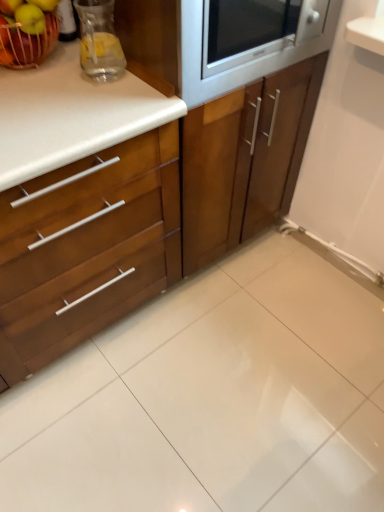
Question: Should I look upward or downward to see clear glass pitcher at upper left?

Choices:
 (A) down
 (B) up

Answer: (B)

Question: Does satin silver microwave at upper center have a lesser height compared to white glossy ceramic tile at center?

Choices:
 (A) yes
 (B) no

Answer: (B)

Question: Considering the relative sizes of satin silver microwave at upper center and white glossy ceramic tile at center in the image provided, is satin silver microwave at upper center taller than white glossy ceramic tile at center?

Choices:
 (A) no
 (B) yes

Answer: (B)

Question: Is satin silver microwave at upper center next to white glossy ceramic tile at center?

Choices:
 (A) yes
 (B) no

Answer: (B)

Question: Is satin silver microwave at upper center outside of white glossy ceramic tile at center?

Choices:
 (A) no
 (B) yes

Answer: (B)

Question: Considering the relative sizes of satin silver microwave at upper center and white glossy ceramic tile at center in the image provided, is satin silver microwave at upper center thinner than white glossy ceramic tile at center?

Choices:
 (A) no
 (B) yes

Answer: (B)

Question: From a real-world perspective, is satin silver microwave at upper center physically below white glossy ceramic tile at center?

Choices:
 (A) yes
 (B) no

Answer: (B)

Question: From a real-world perspective, does shiny red apple at upper left, which appears as the first apple when viewed from the left, stand above wooden cabinet at center, which is counted as the 2th cabinetry, starting from the left?

Choices:
 (A) no
 (B) yes

Answer: (B)

Question: Is shiny red apple at upper left, which appears as the first apple when viewed from the left, to the right of wooden cabinet at center, which is counted as the 2th cabinetry, starting from the left, from the viewer's perspective?

Choices:
 (A) no
 (B) yes

Answer: (A)

Question: From the image's perspective, is shiny red apple at upper left, the 2th apple in the right-to-left sequence, above wooden cabinet at center, positioned as the 1th cabinetry in right-to-left order?

Choices:
 (A) yes
 (B) no

Answer: (A)

Question: Considering the relative positions of shiny red apple at upper left, which appears as the first apple when viewed from the left, and wooden cabinet at center, positioned as the 1th cabinetry in right-to-left order, in the image provided, is shiny red apple at upper left, which appears as the first apple when viewed from the left, behind wooden cabinet at center, positioned as the 1th cabinetry in right-to-left order,?

Choices:
 (A) yes
 (B) no

Answer: (A)

Question: Does shiny red apple at upper left, which appears as the first apple when viewed from the left, have a greater width compared to wooden cabinet at center, which is counted as the 2th cabinetry, starting from the left?

Choices:
 (A) yes
 (B) no

Answer: (B)

Question: Does shiny red apple at upper left, the 2th apple in the right-to-left sequence, have a larger size compared to wooden cabinet at center, which is counted as the 2th cabinetry, starting from the left?

Choices:
 (A) no
 (B) yes

Answer: (A)

Question: Is wooden cabinet at left, which appears as the 1th cabinetry when viewed from the left, surrounding green matte apple at upper left, which appears as the 1th apple when viewed from the right?

Choices:
 (A) no
 (B) yes

Answer: (A)